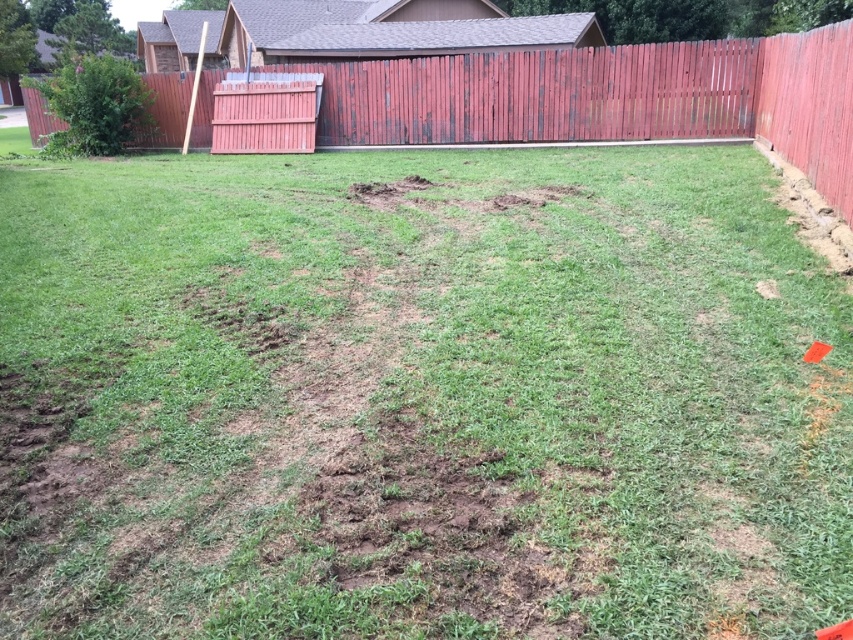
Question: Does weathered wood fence at upper center have a larger size compared to green leafy bush at upper left?

Choices:
 (A) yes
 (B) no

Answer: (B)

Question: Which of the following is the closest to the observer?

Choices:
 (A) green leafy bush at upper left
 (B) weathered wood fence at upper center

Answer: (B)

Question: Can you confirm if weathered wood fence at upper center is bigger than green leafy bush at upper left?

Choices:
 (A) yes
 (B) no

Answer: (B)

Question: Is weathered wood fence at upper center closer to camera compared to green leafy bush at upper left?

Choices:
 (A) no
 (B) yes

Answer: (B)